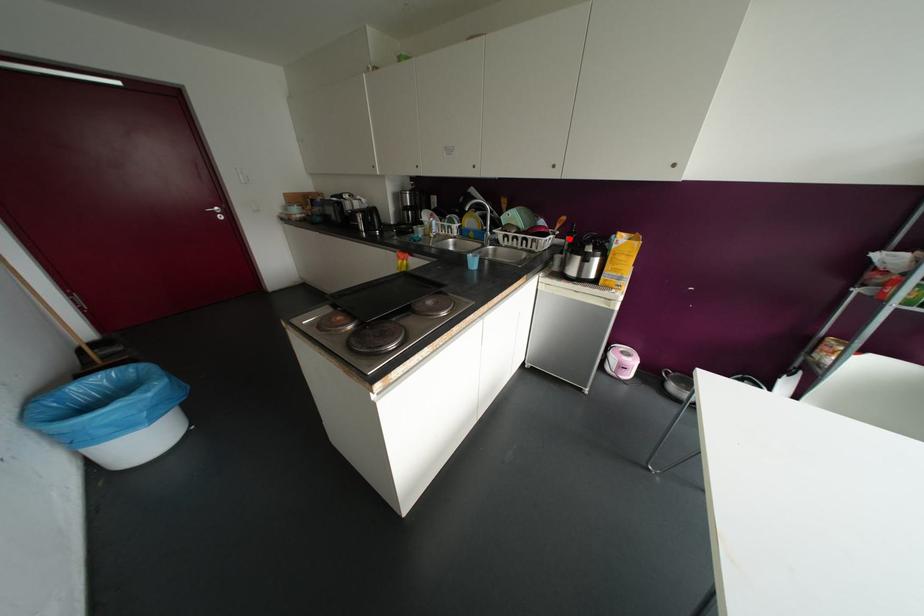
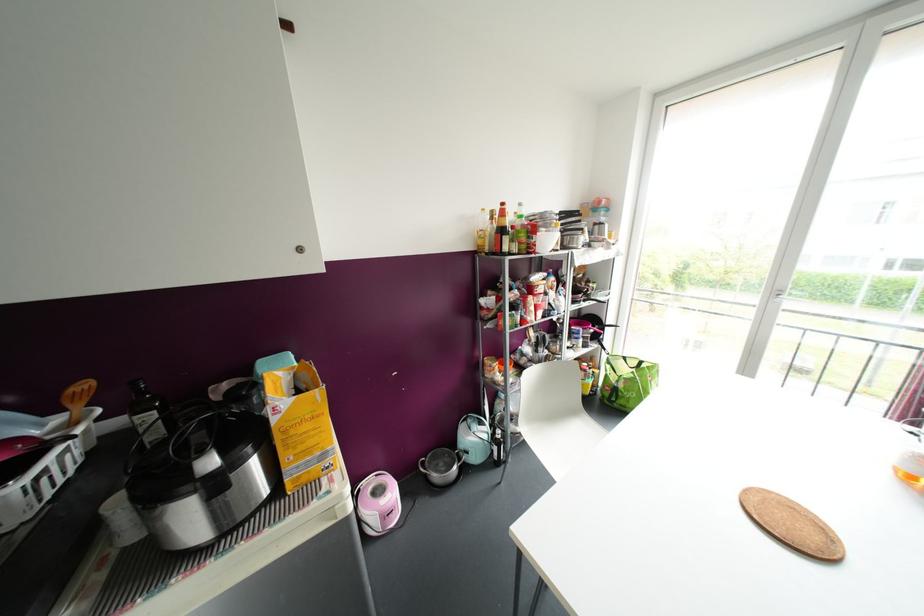
Question: A red point is marked in image1. In image2, is the corresponding 3D point closer to the camera or farther? Reply with the corresponding letter.

Choices:
 (A) The corresponding 3D point is closer.
 (B) The corresponding 3D point is farther.

Answer: (B)